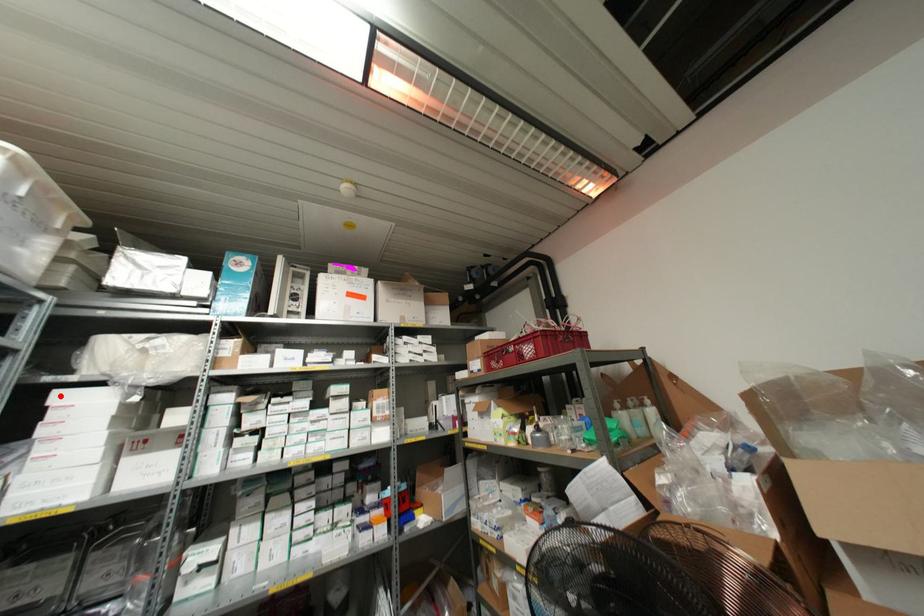
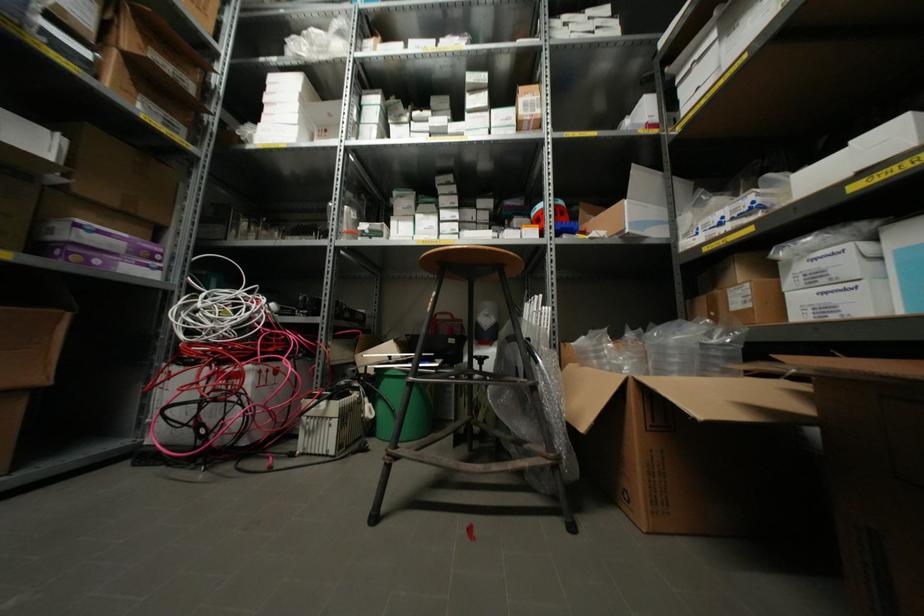
Find the pixel in the second image that matches the highlighted location in the first image.

(272, 79)